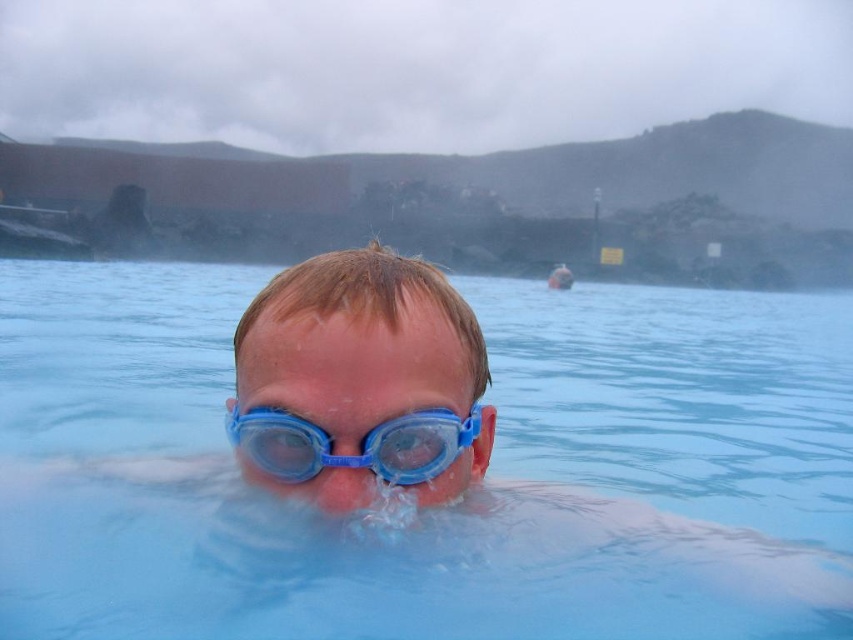
Question: Can you confirm if transparent blue water at center is positioned above blue translucent goggles at center?

Choices:
 (A) no
 (B) yes

Answer: (B)

Question: Is transparent blue water at center above blue translucent goggles at center?

Choices:
 (A) no
 (B) yes

Answer: (B)

Question: Does transparent blue water at center have a smaller size compared to blue translucent goggles at center?

Choices:
 (A) no
 (B) yes

Answer: (A)

Question: Which object appears closest to the camera in this image?

Choices:
 (A) transparent blue water at center
 (B) blue translucent goggles at center

Answer: (B)

Question: Among these objects, which one is nearest to the camera?

Choices:
 (A) transparent blue water at center
 (B) blue translucent goggles at center

Answer: (B)

Question: Which of the following is the farthest from the observer?

Choices:
 (A) blue translucent goggles at center
 (B) transparent blue water at center

Answer: (B)